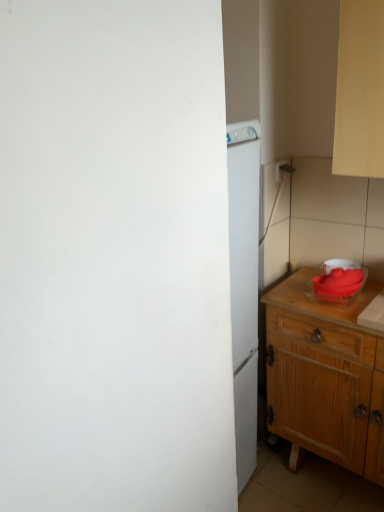
Question: From the image's perspective, is wooden cabinet at right located beneath matte red bowl at right?

Choices:
 (A) yes
 (B) no

Answer: (A)

Question: Is wooden cabinet at right smaller than matte red bowl at right?

Choices:
 (A) no
 (B) yes

Answer: (A)

Question: Can you confirm if wooden cabinet at right is wider than matte red bowl at right?

Choices:
 (A) no
 (B) yes

Answer: (B)

Question: Is the surface of wooden cabinet at right in direct contact with matte red bowl at right?

Choices:
 (A) yes
 (B) no

Answer: (B)

Question: From a real-world perspective, is wooden cabinet at right physically above matte red bowl at right?

Choices:
 (A) no
 (B) yes

Answer: (A)

Question: Is wooden cabinet at right oriented away from matte red bowl at right?

Choices:
 (A) yes
 (B) no

Answer: (B)

Question: From a real-world perspective, is white plastic electric outlet at upper right located higher than matte red bowl at right?

Choices:
 (A) no
 (B) yes

Answer: (B)

Question: Is the position of white plastic electric outlet at upper right more distant than that of matte red bowl at right?

Choices:
 (A) no
 (B) yes

Answer: (B)

Question: Considering the relative sizes of white plastic electric outlet at upper right and matte red bowl at right in the image provided, is white plastic electric outlet at upper right smaller than matte red bowl at right?

Choices:
 (A) yes
 (B) no

Answer: (A)

Question: From a real-world perspective, is white plastic electric outlet at upper right located beneath matte red bowl at right?

Choices:
 (A) yes
 (B) no

Answer: (B)

Question: Does white plastic electric outlet at upper right contain matte red bowl at right?

Choices:
 (A) yes
 (B) no

Answer: (B)

Question: Is white plastic electric outlet at upper right not inside matte red bowl at right?

Choices:
 (A) yes
 (B) no

Answer: (A)

Question: Is matte red bowl at right at the right side of wooden cabinet at right?

Choices:
 (A) yes
 (B) no

Answer: (B)